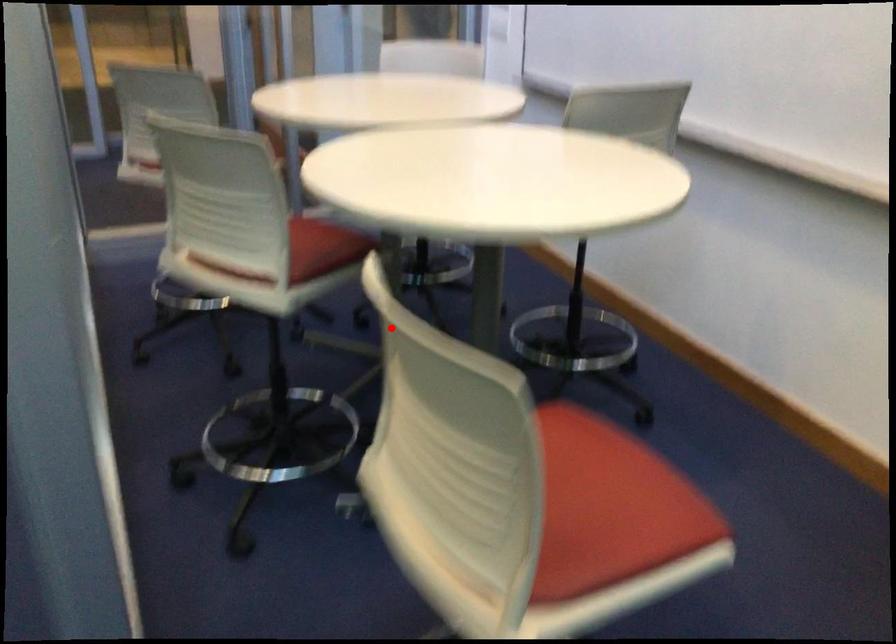
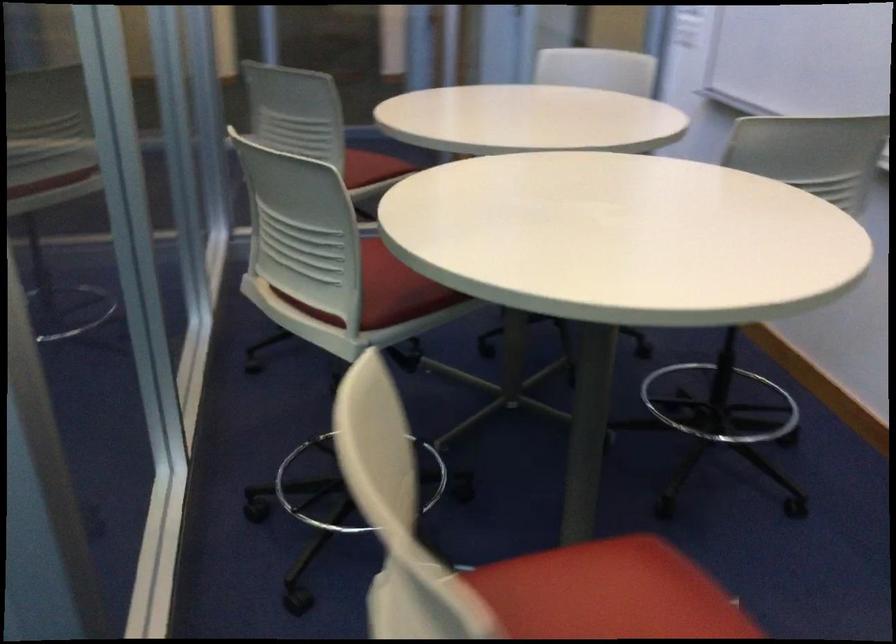
Question: I am providing you with two images of the same scene from different viewpoints. A red point is shown in image1. For the corresponding object point in image2, is it positioned nearer or farther from the camera?

Choices:
 (A) Nearer
 (B) Farther

Answer: (A)